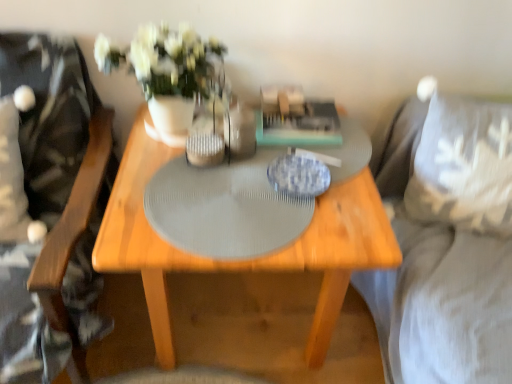
Where is `free region under gray textured placemat at center (from a real-world perspective)`? This screenshot has width=512, height=384. free region under gray textured placemat at center (from a real-world perspective) is located at coordinates (224, 205).